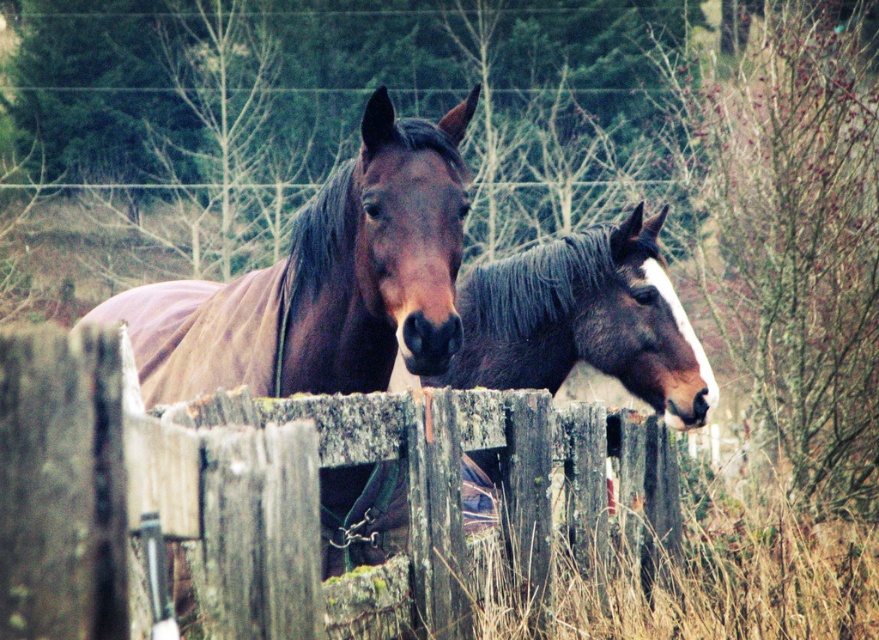
Question: Which of these objects is positioned farthest from the brown glossy horse at center?

Choices:
 (A) weathered wood fence at center
 (B) shiny brown horse at center

Answer: (B)

Question: Among these objects, which one is farthest from the camera?

Choices:
 (A) weathered wood fence at center
 (B) brown glossy horse at center

Answer: (B)

Question: Based on their relative distances, which object is nearer to the weathered wood fence at center?

Choices:
 (A) brown glossy horse at center
 (B) shiny brown horse at center

Answer: (A)

Question: Is weathered wood fence at center closer to camera compared to brown glossy horse at center?

Choices:
 (A) yes
 (B) no

Answer: (A)

Question: Is weathered wood fence at center positioned at the back of shiny brown horse at center?

Choices:
 (A) yes
 (B) no

Answer: (A)

Question: Does shiny brown horse at center have a greater width compared to brown glossy horse at center?

Choices:
 (A) no
 (B) yes

Answer: (B)